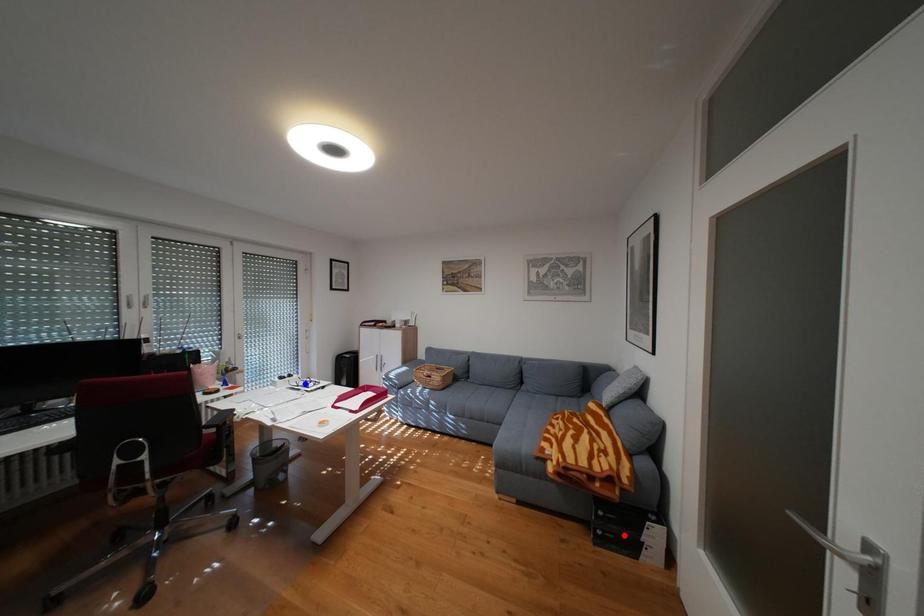
Question: In the image, two points are highlighted. Which point is nearer to the camera? Reply with the corresponding letter.

Choices:
 (A) blue point
 (B) red point

Answer: (B)